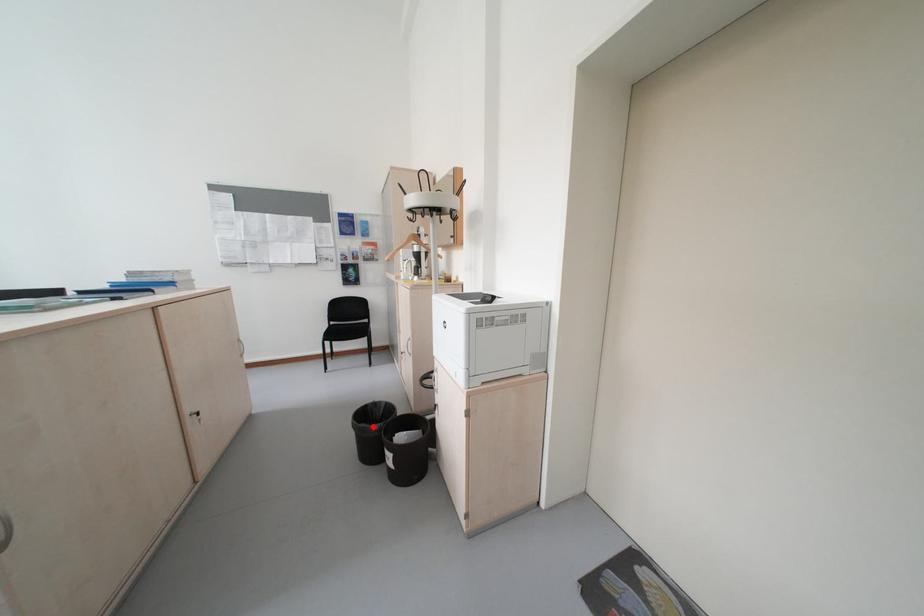
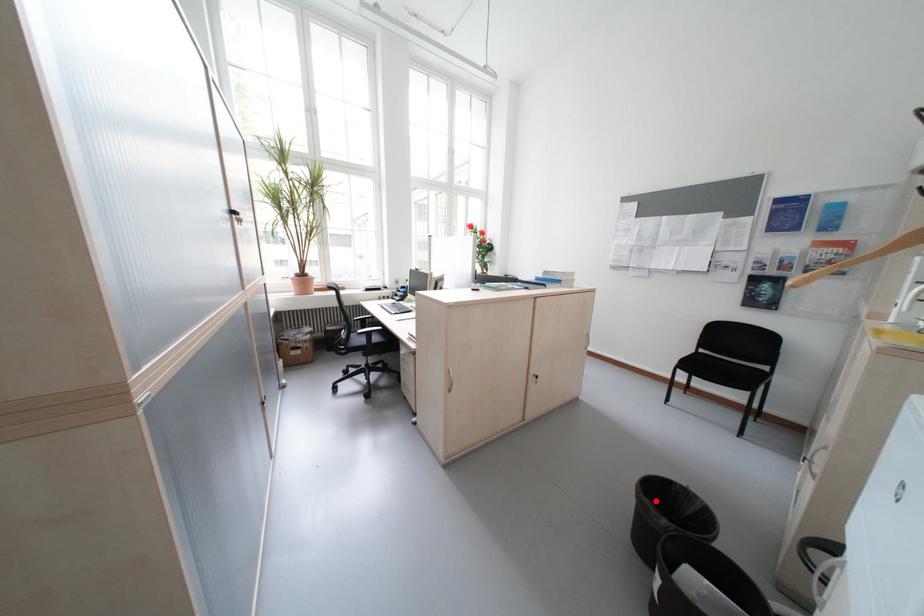
I am providing you with two images of the same scene from different viewpoints. A red point is marked on the first image and another point is marked on the second image. Is the marked point in image1 the same physical position as the marked point in image2?

Yes